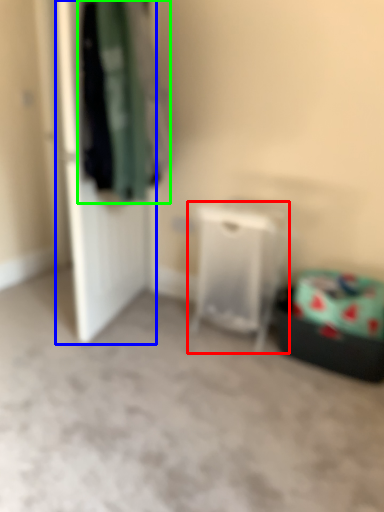
Question: Which is nearer to the furniture (highlighted by a red box)? door (highlighted by a blue box) or clothing (highlighted by a green box).

Choices:
 (A) door
 (B) clothing

Answer: (B)